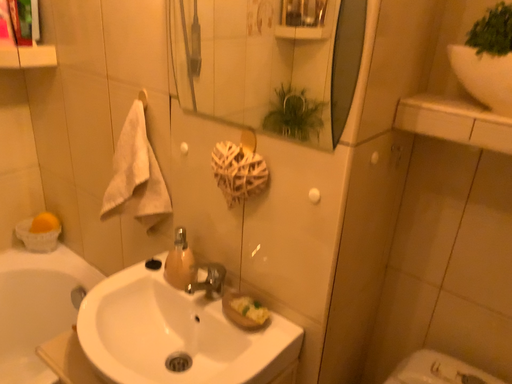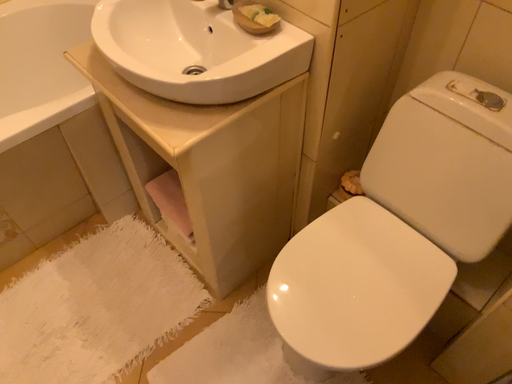
Question: Which way did the camera rotate in the video?

Choices:
 (A) rotated left
 (B) rotated right

Answer: (A)